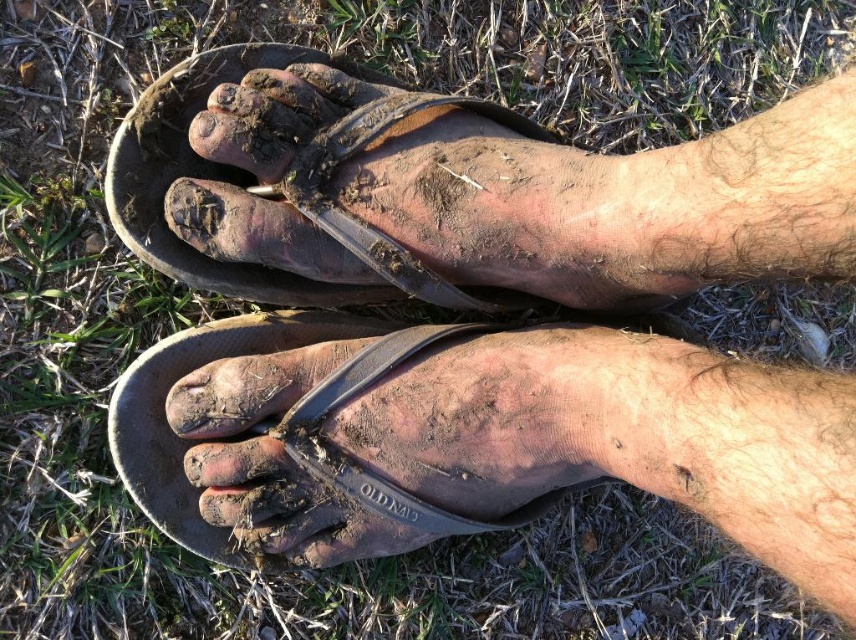
Which is below, muddy rubber flip-flop at center or brown leather toe at lower center?

brown leather toe at lower center is lower down.

Which is in front, point (259, 426) or point (263, 470)?

Point (263, 470) is more forward.

I want to click on muddy rubber flip-flop at center, so click(280, 426).

Does point (473, 522) come closer to viewer compared to point (235, 90)?

That is False.

Between muddy rubber flip-flop at center and brown matte toe at upper center, which one is positioned higher?

brown matte toe at upper center

Locate an element on the screen. muddy rubber flip-flop at center is located at coordinates (280, 426).

Which of these two, brown leather toe at lower center or brown matte toe at upper center, stands shorter?

With less height is brown matte toe at upper center.

Consider the image. Who is taller, brown leather toe at lower center or brown matte toe at upper center?

brown leather toe at lower center is taller.

What do you see at coordinates (235, 464) in the screenshot?
I see `brown leather toe at lower center` at bounding box center [235, 464].

Locate an element on the screen. brown leather toe at lower center is located at coordinates 235,464.